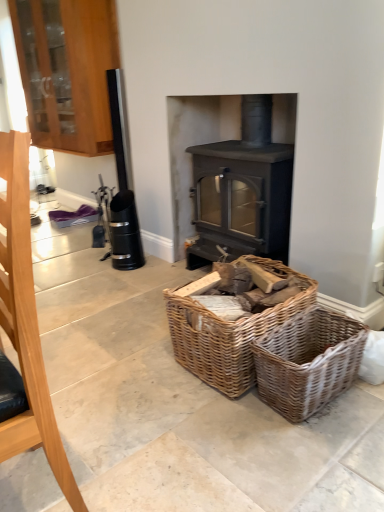
You are a GUI agent. You are given a task and a screenshot of the screen. Output one action in this format:
    pyautogui.click(x=<x>, y=<y>)
    Task: Click on the free space in front of woven wood basket at center
    This screenshot has width=384, height=512.
    Given the screenshot: What is the action you would take?
    pyautogui.click(x=242, y=436)